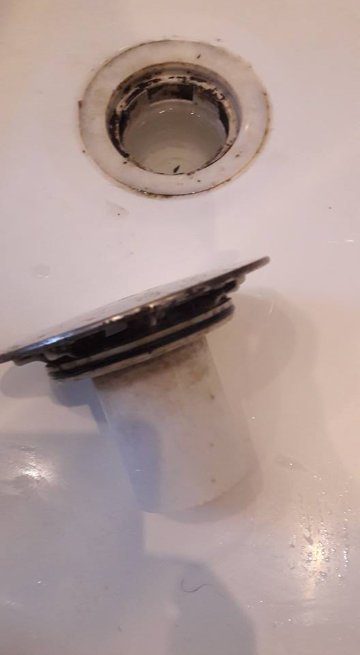
At what (x,y) coordinates should I click in order to perform the action: click on ceiling light reflection. Please return your answer as a coordinate pair (x, y). The width and height of the screenshot is (360, 655). Looking at the image, I should click on coord(318,552), coord(31,472), coord(155,278).